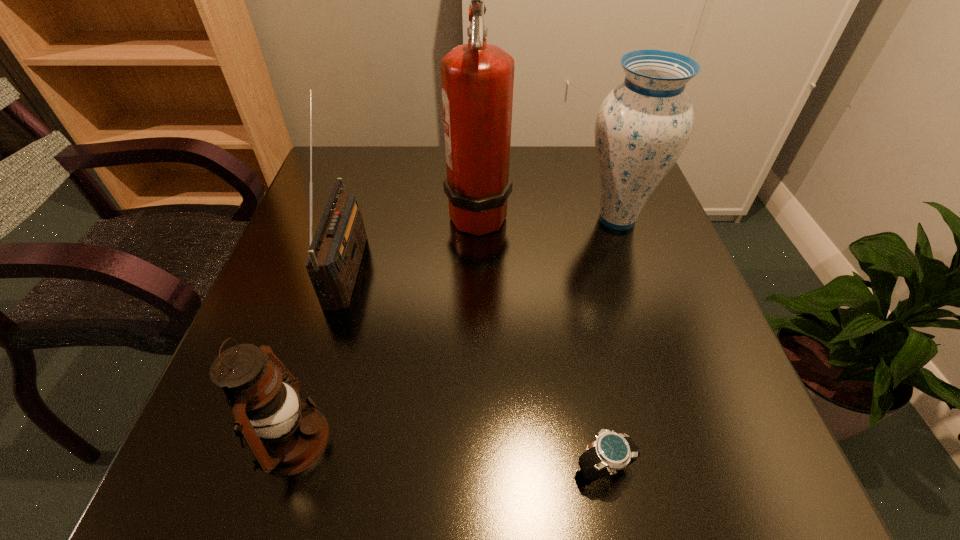
Where is `free space located 0.360m on the side of the second shortest object, there is a wick adjustment knob`? Image resolution: width=960 pixels, height=540 pixels. free space located 0.360m on the side of the second shortest object, there is a wick adjustment knob is located at coordinates (567, 440).

Where is `free space located 0.350m on the left of the shortest object`? Image resolution: width=960 pixels, height=540 pixels. free space located 0.350m on the left of the shortest object is located at coordinates (332, 467).

I want to click on fire extinguisher present at the far edge, so click(x=477, y=79).

The height and width of the screenshot is (540, 960). In order to click on vase present at the far edge in this screenshot , I will do `click(643, 125)`.

You are a GUI agent. You are given a task and a screenshot of the screen. Output one action in this format:
    pyautogui.click(x=<x>, y=<y>)
    Task: Click on the lantern located at the near edge
    
    Given the screenshot: What is the action you would take?
    pyautogui.click(x=285, y=435)

Locate an element on the screen. watch present at the near edge is located at coordinates (610, 452).

This screenshot has width=960, height=540. What are the coordinates of `radio receiver located in the left edge section of the desktop` in the screenshot? It's located at (335, 252).

In order to click on lantern that is at the left edge in this screenshot , I will do `click(285, 435)`.

Where is `object that is positioned at the right edge`? This screenshot has height=540, width=960. object that is positioned at the right edge is located at coordinates (643, 125).

This screenshot has height=540, width=960. Identify the location of object situated at the near left corner. [x=285, y=435].